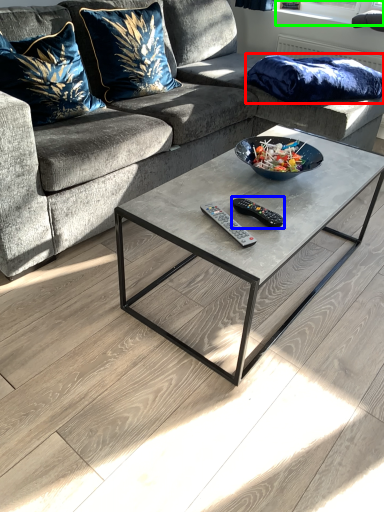
Question: Which object is positioned farthest from pillow (highlighted by a red box)? Select from remote (highlighted by a blue box) and window screen (highlighted by a green box).

Choices:
 (A) remote
 (B) window screen

Answer: (A)